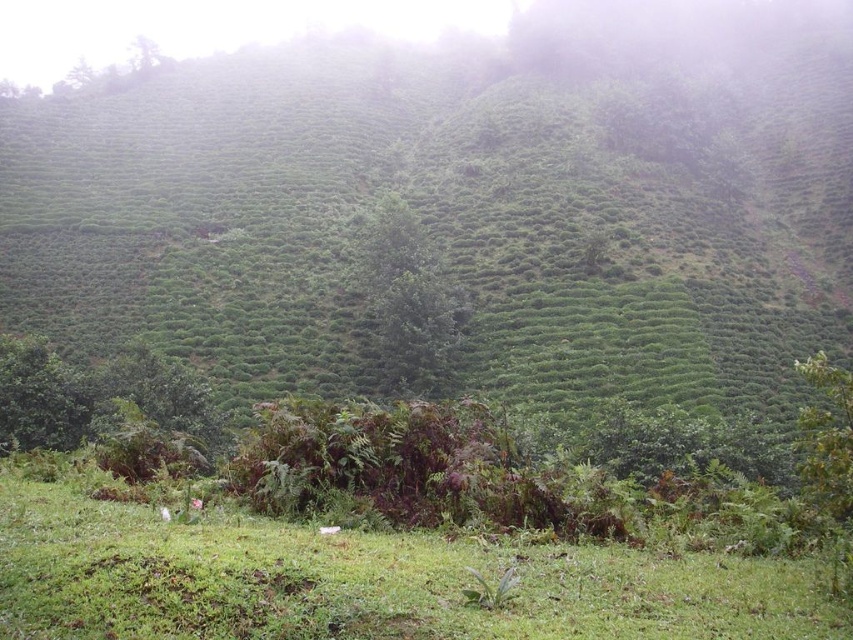
Can you confirm if green leafy hillside at center is shorter than green grassy at lower center?

No.

Does green leafy hillside at center have a greater height compared to green grassy at lower center?

Yes.

The height and width of the screenshot is (640, 853). What do you see at coordinates (460, 211) in the screenshot?
I see `green leafy hillside at center` at bounding box center [460, 211].

What are the coordinates of `green leafy hillside at center` in the screenshot? It's located at (460, 211).